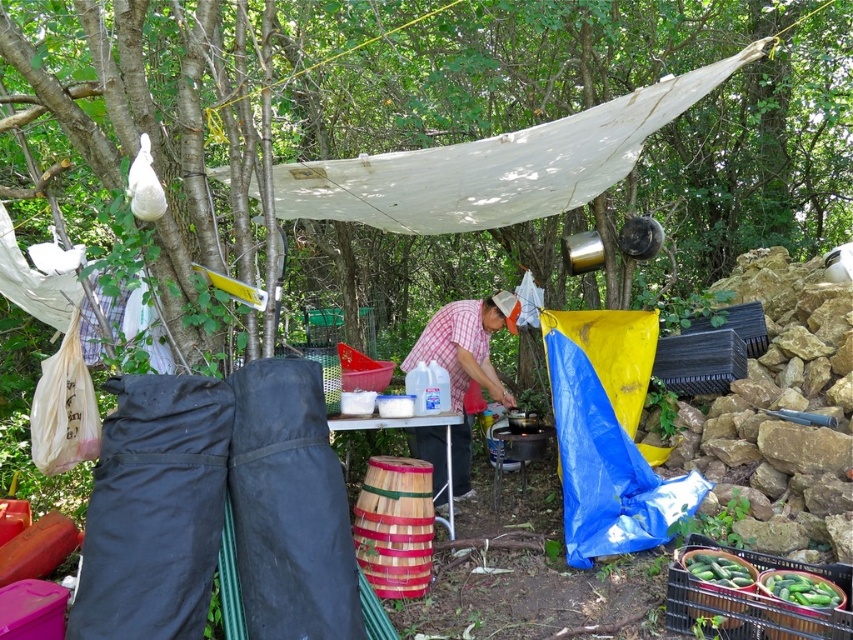
Measure the distance between blue tarp at lower right and plaid shirt at center.

blue tarp at lower right is 75.65 centimeters away from plaid shirt at center.

Is point (637, 397) farther from camera compared to point (453, 374)?

No.

Measure the distance between blue tarp at lower right and camera.

blue tarp at lower right is 3.35 meters from camera.

Where is `blue tarp at lower right`? The width and height of the screenshot is (853, 640). blue tarp at lower right is located at coordinates (608, 435).

Who is shorter, blue tarp at lower right or white plastic picnic table at center?

white plastic picnic table at center

Who is positioned more to the right, blue tarp at lower right or white plastic picnic table at center?

blue tarp at lower right

Between point (619, 486) and point (337, 419), which one is positioned behind?

The point (619, 486) is more distant.

What are the coordinates of `blue tarp at lower right` in the screenshot? It's located at (608, 435).

Does brown wood tree at upper left have a greater width compared to plaid shirt at center?

Correct, the width of brown wood tree at upper left exceeds that of plaid shirt at center.

Who is higher up, brown wood tree at upper left or plaid shirt at center?

brown wood tree at upper left is above.

Is point (326, 150) positioned before point (439, 328)?

No, (326, 150) is further to viewer.

This screenshot has width=853, height=640. Identify the location of brown wood tree at upper left. (596, 104).